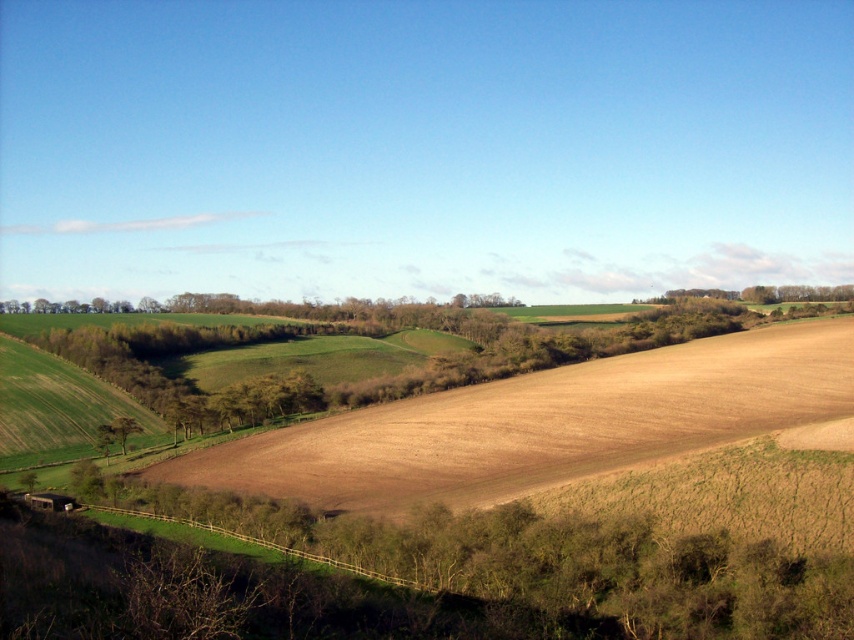
You are a farmer planning to plant crops in the brown soil at lower left and green leafy tree at lower left. Considering their widths, which area can accommodate wider rows of crops?

The brown soil at lower left has a greater width than the green leafy tree at lower left, so it can accommodate wider rows of crops.

You are a farmer planning to plant crops in the brown soil at lower left and the green leafy tree at lower left. Which area has enough space for planting a large crop field?

The brown soil at lower left is larger in size than the green leafy tree at lower left, so the brown soil at lower left has enough space for planting a large crop field.